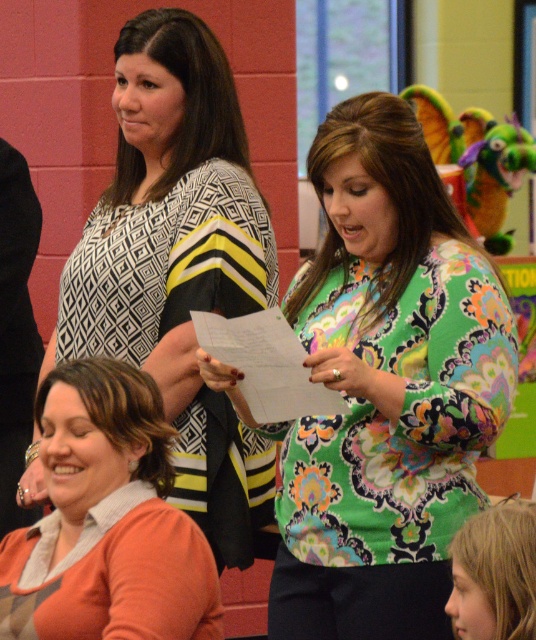
You are taking a photo of the scene and want to focus on both point A at point (276, 602) and point B at point (456, 561). Which point should you focus on first to ensure both are in focus?

You should focus on point A at point (276, 602) first because it is closer to the camera than point B at point (456, 561). By focusing on the closer point, the depth of field may extend to include the farther point as well.

You are a photographer trying to capture a group photo of the orange soft sweater at lower left and the blonde hair at lower right. Since you want to ensure both subjects are centered in the frame, which direction should you move the camera to align them properly?

The orange soft sweater at lower left is positioned on the left side of blonde hair at lower right, so to center both subjects in the frame, move the camera slightly to the left to bring the orange soft sweater at lower left closer to the center while keeping the blonde hair at lower right in alignment.

You are a photographer setting up for a group photo. You want to ensure everyone is in frame. The camera you have has a maximum focus range of 35 inches. The floral print blouse at center and blonde hair at lower right are two key subjects. Can both be in focus at the same time?

The distance between the floral print blouse at center and blonde hair at lower right is 35.01 inches, which exceeds the camera maximum focus range of 35 inches. Therefore, both cannot be in focus simultaneously.